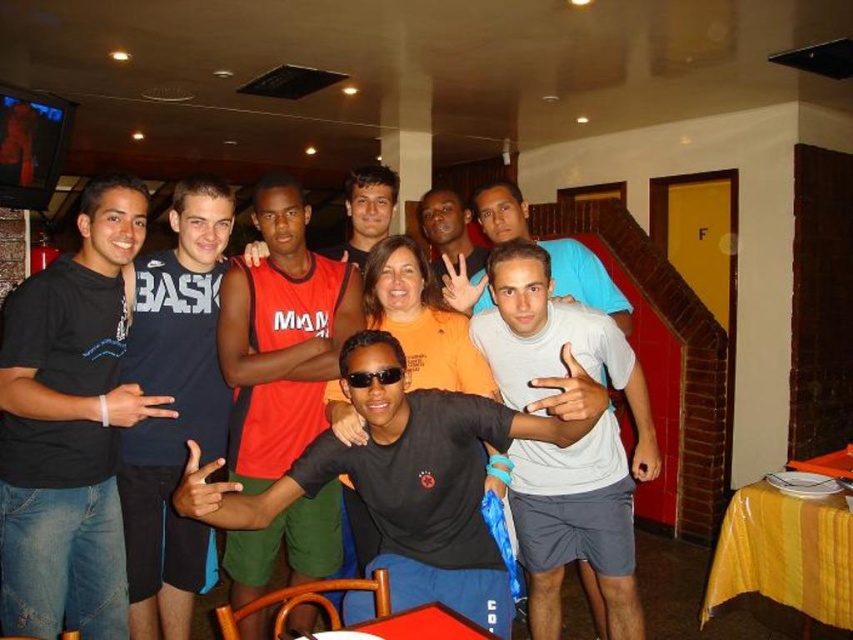
Between point (471, 445) and point (634, 413), which one is positioned behind?

Point (634, 413)

Is black matte t-shirt at center thinner than white cotton t-shirt at center?

In fact, black matte t-shirt at center might be wider than white cotton t-shirt at center.

Is point (450, 397) positioned before point (573, 515)?

Yes.

Where is `black matte t-shirt at center`? black matte t-shirt at center is located at coordinates (401, 481).

Does red jersey at center come behind black cotton t-shirt at center?

No.

What do you see at coordinates (281, 337) in the screenshot? I see `red jersey at center` at bounding box center [281, 337].

Is point (289, 250) less distant than point (225, 442)?

Yes.

Find the location of a particular element. The width and height of the screenshot is (853, 640). red jersey at center is located at coordinates (281, 337).

Between black cotton t-shirt at left and black matte t-shirt at center, which one is positioned higher?

black cotton t-shirt at left

Does black cotton t-shirt at left have a greater width compared to black matte t-shirt at center?

In fact, black cotton t-shirt at left might be narrower than black matte t-shirt at center.

Is point (44, 628) farther from viewer compared to point (488, 598)?

That is True.

Image resolution: width=853 pixels, height=640 pixels. Identify the location of black cotton t-shirt at left. (68, 428).